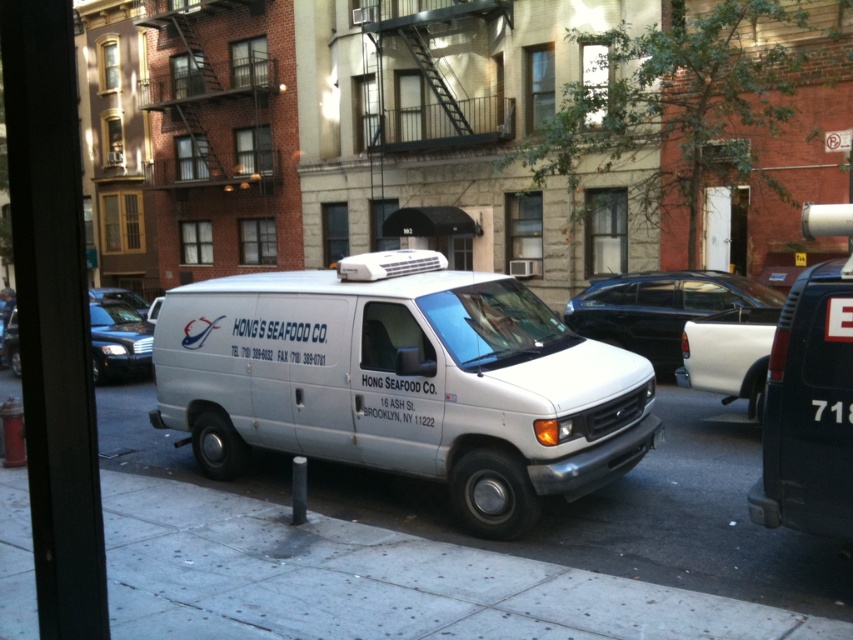
You are a delivery driver trying to park your white delivery van between two fire escapes on the street. The van is 20 feet long. There are two points marked at coordinates point A at (152, 444) and point B at 0.306, 0.821. Can the van fit between these two points?

The distance between point A at (152, 444) and point B at 0.306, 0.821 is 35.07 feet. Since the van is 20 feet long, it can fit between these two points as the distance is greater than the van length.

From the picture: You are a delivery driver who needs to park your white delivery van between the gray concrete pavement at center and the shiny black sedan at left. Can you fit the van in the available space between them?

The gray concrete pavement at center has a smaller size compared to shiny black sedan at left, so the space between them may be sufficient to park the van. However, since the pavement is smaller, the exact dimensions of the space are unclear. It is recommended to measure the distance before attempting to park.

You are a delivery person who needs to back the white delivery van into a parking spot between the black glossy sedan at center and the shiny black sedan at left. The parking spot requires a minimum clearance of 30 feet between the two vehicles. Can the van fit in the available space?

The distance between the black glossy sedan at center and the shiny black sedan at left is 40.28 feet, which exceeds the required 30 feet clearance. Therefore, the white delivery van can safely fit in the parking spot between them.